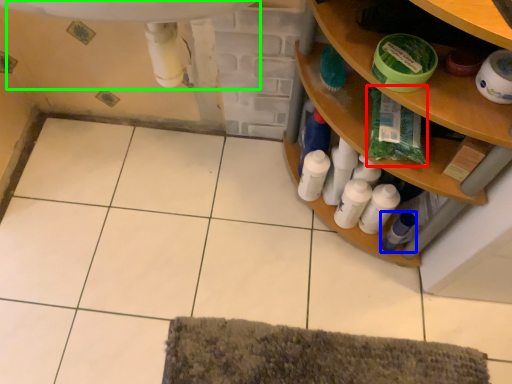
Question: Based on their relative distances, which object is nearer to material (highlighted by a red box)? Choose from toiletry (highlighted by a blue box) and sink (highlighted by a green box).

Choices:
 (A) toiletry
 (B) sink

Answer: (A)